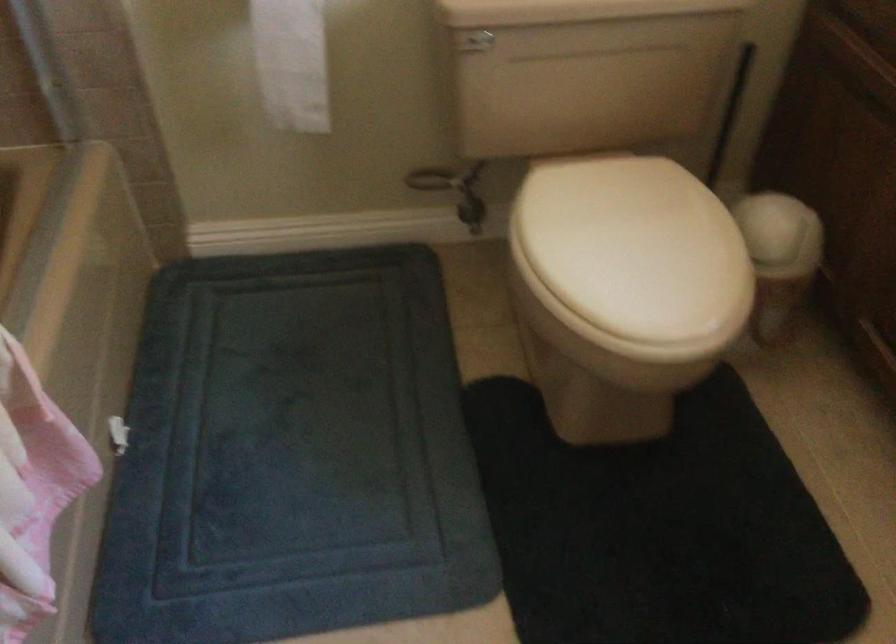
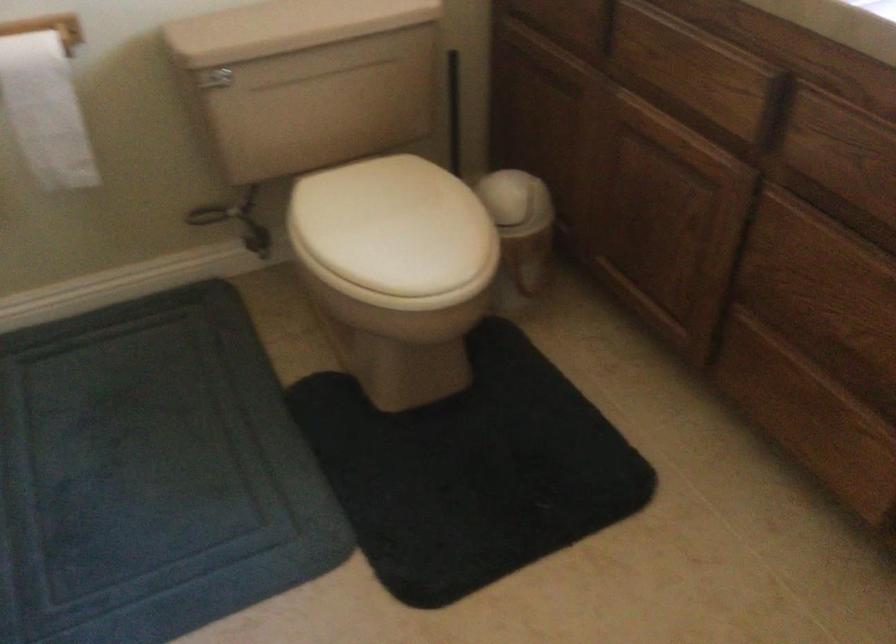
Question: The first image is from the beginning of the video and the second image is from the end. How did the camera likely rotate when shooting the video?

Choices:
 (A) Left
 (B) Right
 (C) Up
 (D) Down

Answer: (B)